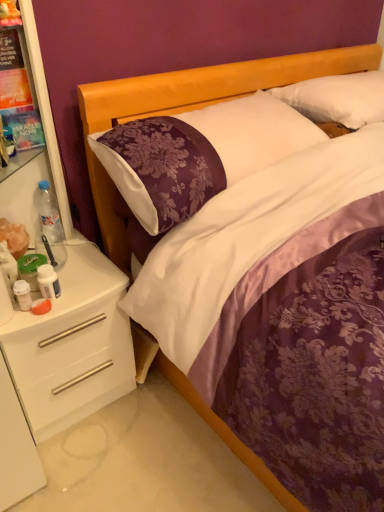
At what (x,y) coordinates should I click in order to perform the action: click on free space on the front side of clear plastic bottle at left, placed as the first bottle when sorted from back to front. Please return your answer as a coordinate pair (x, y). The width and height of the screenshot is (384, 512). Looking at the image, I should click on (73, 268).